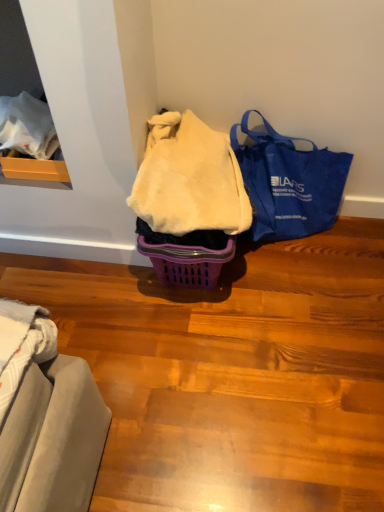
Describe the element at coordinates (189, 179) in the screenshot. I see `white fluffy blanket at center` at that location.

Find the location of a particular element. The width and height of the screenshot is (384, 512). white fluffy blanket at center is located at coordinates (189, 179).

Measure the distance between point (287, 142) and camera.

The distance of point (287, 142) from camera is 1.36 meters.

Locate an element on the screen. This screenshot has width=384, height=512. blue canvas tote bag at right is located at coordinates (289, 183).

What do you see at coordinates (289, 183) in the screenshot? This screenshot has height=512, width=384. I see `blue canvas tote bag at right` at bounding box center [289, 183].

You are a GUI agent. You are given a task and a screenshot of the screen. Output one action in this format:
    pyautogui.click(x=<x>, y=<y>)
    Task: Click on the white fluffy blanket at center
    Image resolution: width=384 pixels, height=512 pixels.
    Given the screenshot: What is the action you would take?
    pyautogui.click(x=189, y=179)

Between white fluffy blanket at center and blue canvas tote bag at right, which one appears on the right side from the viewer's perspective?

blue canvas tote bag at right.

Who is more distant, white fluffy blanket at center or blue canvas tote bag at right?

Positioned behind is blue canvas tote bag at right.

Between point (139, 182) and point (275, 158), which one is positioned behind?

The point (275, 158) is behind.

From the image's perspective, which object appears higher, white fluffy blanket at center or blue canvas tote bag at right?

white fluffy blanket at center is shown above in the image.

From a real-world perspective, who is located lower, white fluffy blanket at center or blue canvas tote bag at right?

In real-world perspective, blue canvas tote bag at right is lower.

Between white fluffy blanket at center and blue canvas tote bag at right, which one has smaller width?

Thinner between the two is blue canvas tote bag at right.

Is white fluffy blanket at center taller than blue canvas tote bag at right?

Incorrect, the height of white fluffy blanket at center is not larger of that of blue canvas tote bag at right.

Can you confirm if white fluffy blanket at center is bigger than blue canvas tote bag at right?

No.

Is white fluffy blanket at center inside or outside of blue canvas tote bag at right?

white fluffy blanket at center exists outside the volume of blue canvas tote bag at right.

Are white fluffy blanket at center and blue canvas tote bag at right far apart?

They are positioned close to each other.

Is white fluffy blanket at center facing away from blue canvas tote bag at right?

white fluffy blanket at center is not turned away from blue canvas tote bag at right.

How different are the orientations of white fluffy blanket at center and blue canvas tote bag at right in degrees?

They differ by 0.000294 degrees in their facing directions.

Identify the location of handbag below the white fluffy blanket at center (from a real-world perspective). (289, 183).

Considering the positions of objects blue canvas tote bag at right and white fluffy blanket at center in the image provided, who is more to the left, blue canvas tote bag at right or white fluffy blanket at center?

Positioned to the left is white fluffy blanket at center.

Is blue canvas tote bag at right closer to camera compared to white fluffy blanket at center?

No, blue canvas tote bag at right is further to the viewer.

Considering the positions of point (289, 138) and point (194, 217), is point (289, 138) closer or farther from the camera than point (194, 217)?

Clearly, point (289, 138) is more distant from the camera than point (194, 217).

From the image's perspective, is blue canvas tote bag at right located beneath white fluffy blanket at center?

Yes, from the image's perspective, blue canvas tote bag at right is beneath white fluffy blanket at center.

From a real-world perspective, is blue canvas tote bag at right physically located above or below white fluffy blanket at center?

Clearly, from a real-world perspective, blue canvas tote bag at right is below white fluffy blanket at center.

Is blue canvas tote bag at right wider than white fluffy blanket at center?

In fact, blue canvas tote bag at right might be narrower than white fluffy blanket at center.

Between blue canvas tote bag at right and white fluffy blanket at center, which one has less height?

With less height is white fluffy blanket at center.

Which of these two, blue canvas tote bag at right or white fluffy blanket at center, is bigger?

With larger size is blue canvas tote bag at right.

Is blue canvas tote bag at right outside of white fluffy blanket at center?

Absolutely, blue canvas tote bag at right is external to white fluffy blanket at center.

Can you see blue canvas tote bag at right touching white fluffy blanket at center?

blue canvas tote bag at right and white fluffy blanket at center are clearly separated.

Is blue canvas tote bag at right looking in the opposite direction of white fluffy blanket at center?

No.

The height and width of the screenshot is (512, 384). I want to click on blanket in front of the blue canvas tote bag at right, so (x=189, y=179).

The image size is (384, 512). Identify the location of handbag lying behind the white fluffy blanket at center. (289, 183).

Where is `handbag below the white fluffy blanket at center (from a real-world perspective)`? The height and width of the screenshot is (512, 384). handbag below the white fluffy blanket at center (from a real-world perspective) is located at coordinates (289, 183).